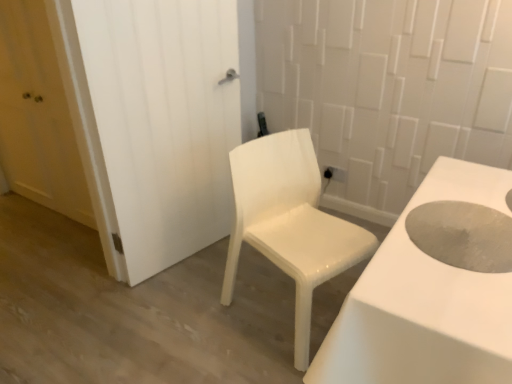
You are a GUI agent. You are given a task and a screenshot of the screen. Output one action in this format:
    pyautogui.click(x=<x>, y=<y>)
    Task: Click on the free spot in front of white matte door at center, which is the 1th door from right to left
    The width and height of the screenshot is (512, 384).
    Given the screenshot: What is the action you would take?
    pyautogui.click(x=168, y=307)